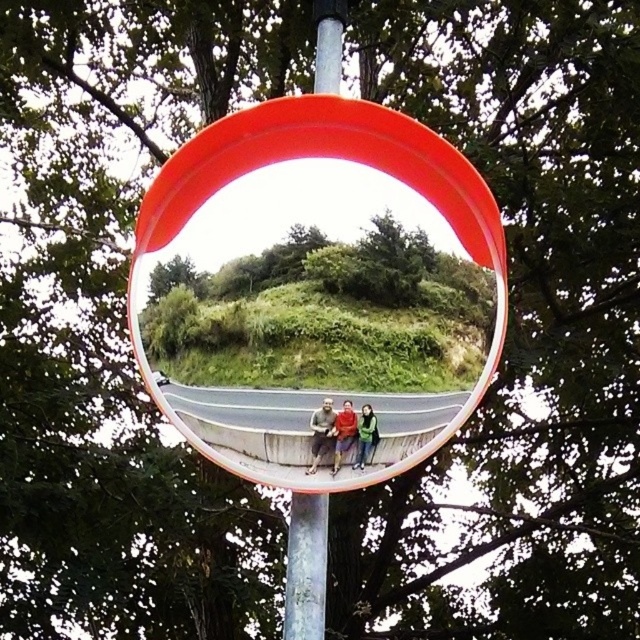
Consider the image. You are a photographer trying to capture a group photo of the three individuals sitting on the concrete ledge. You want to ensure that the matte gray shirt at center and the red fabric jacket at center are positioned close enough to each other in the photo. Based on the reflection in the convex traffic mirror, what is the minimum distance you should maintain between them to achieve this?

The matte gray shirt at center is 1.16 inches away from the red fabric jacket at center in the reflection. To maintain their proximity in the photo, you should ensure they stay within approximately 1.16 inches apart.

You are standing in the scene shown in the image. You want to locate the metallic gray pole at center. Where would you look relative to the convex traffic mirror?

The metallic gray pole at center is located at the 2D coordinates point (307, 566) in the image.

You are a delivery driver who needs to check the blind spot behind your truck. You see the transparent plastic view mirror at center and the matte gray shirt at center in your rearview mirror. Which object is positioned higher in the reflection?

The transparent plastic view mirror at center is located above the matte gray shirt at center in the reflection, so it is positioned higher.